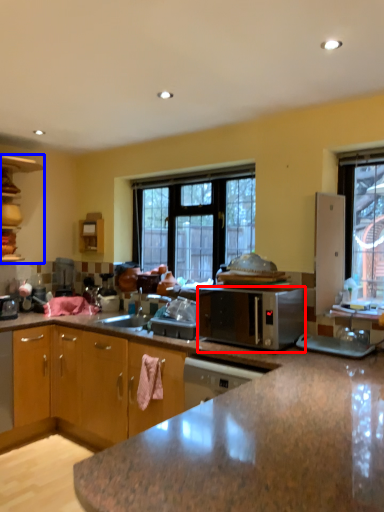
Question: Which of the following is the closest to the observer, microwave oven (highlighted by a red box) or cabinetry (highlighted by a blue box)?

Choices:
 (A) microwave oven
 (B) cabinetry

Answer: (A)